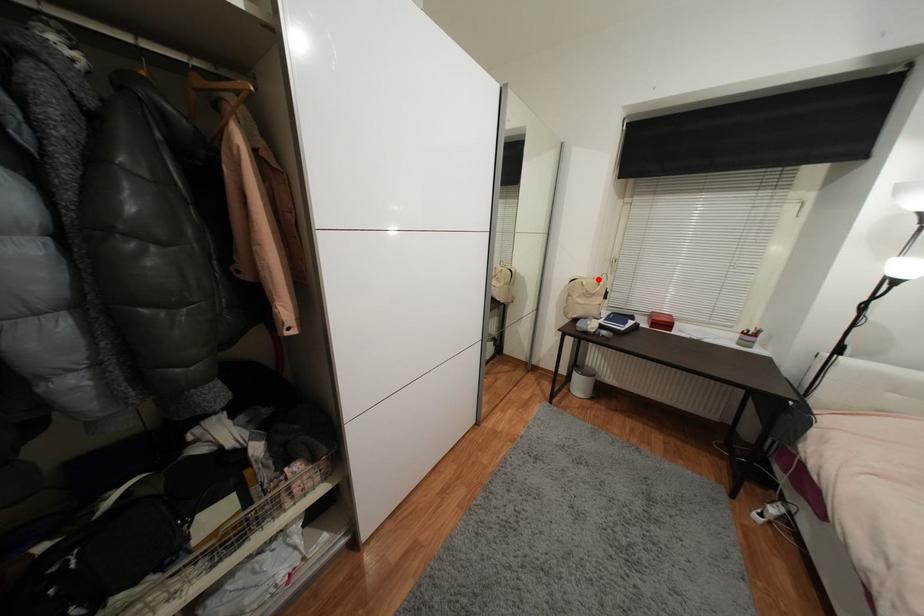
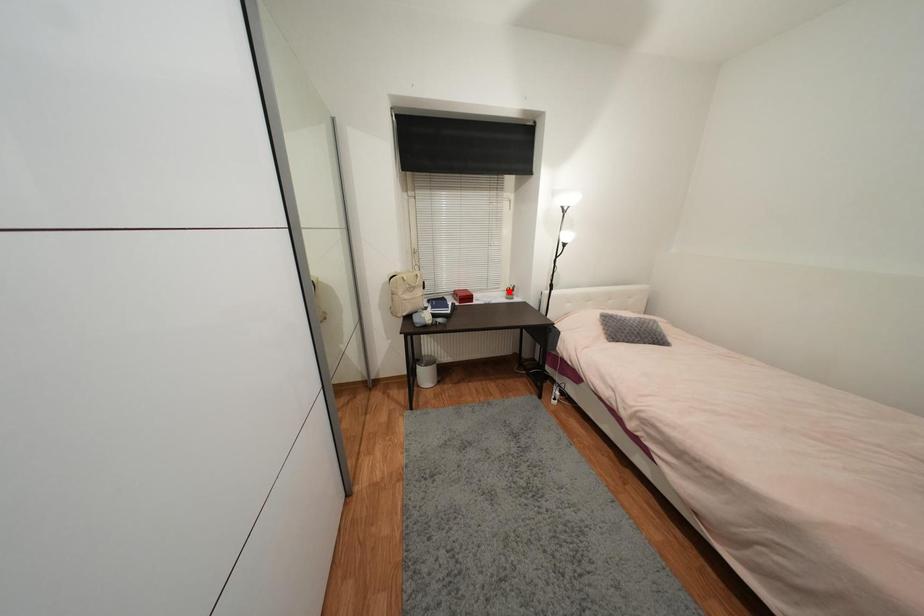
I am providing you with two images of the same scene from different viewpoints. A red point is marked on the first image and another point is marked on the second image. Are the points marked in image1 and image2 representing the same 3D position?

No